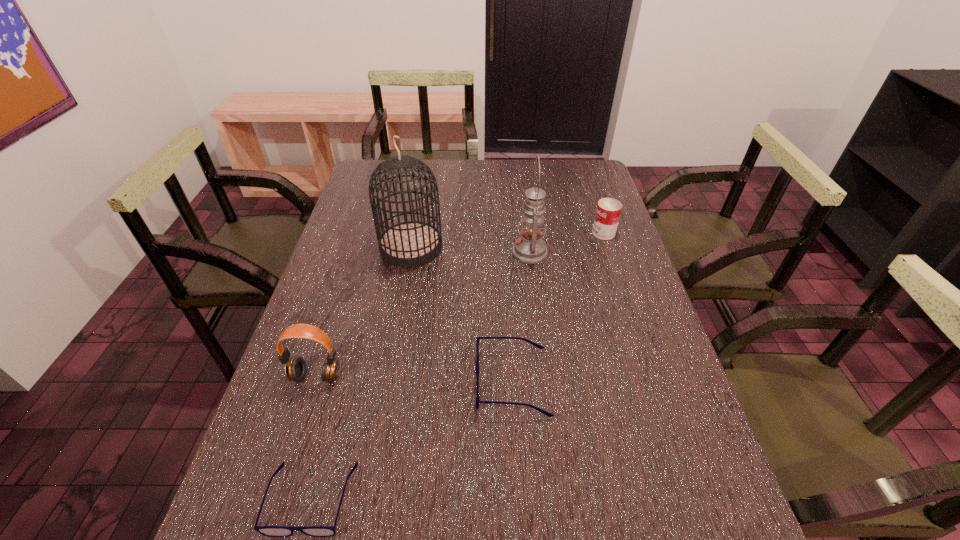
I want to click on free point that keeps the spectacless evenly spaced on the right, so click(650, 302).